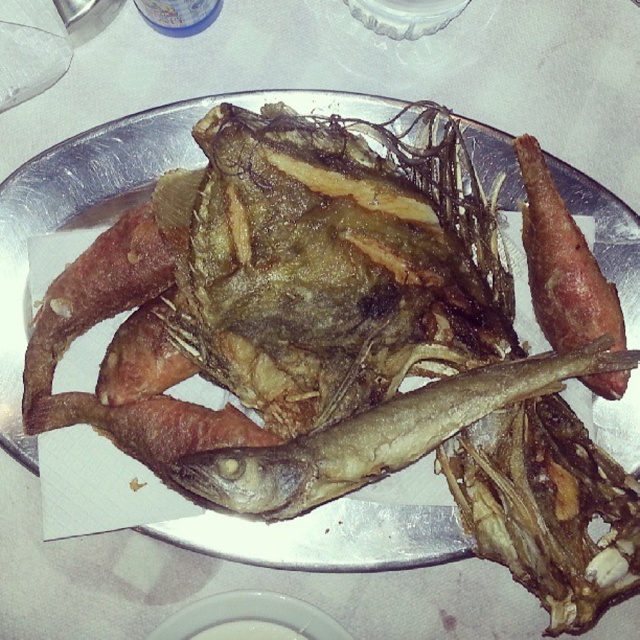
You are a food critic evaluating the presentation of this dish. Considering the brown crispy fish at center and the white glossy plate at center, which object appears larger in height?

The brown crispy fish at center is much taller than the white glossy plate at center, so it appears larger in height.

You are a chef arranging ingredients on a white glossy plate at center. You want to place the brown crispy bacon at right on the plate. Can you estimate whether the bacon is already on the plate or needs to be placed there?

The brown crispy bacon at right is closer to the viewer than the white glossy plate at center, so it is not on the plate yet and needs to be placed there.

You are standing in front of the plate of fried seafood. There is a point at coordinate (547, 316) on the plate. If you want to reach that point with a 1.0 meter long fork, can you reach it?

The point at coordinate (547, 316) is 1.20 meters away from the viewer, so the fork is too short to reach it.